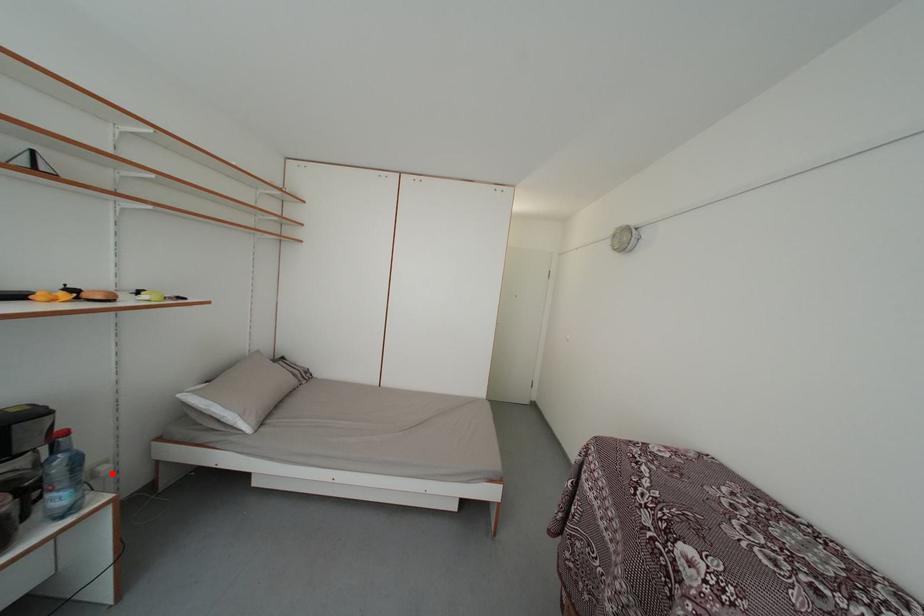
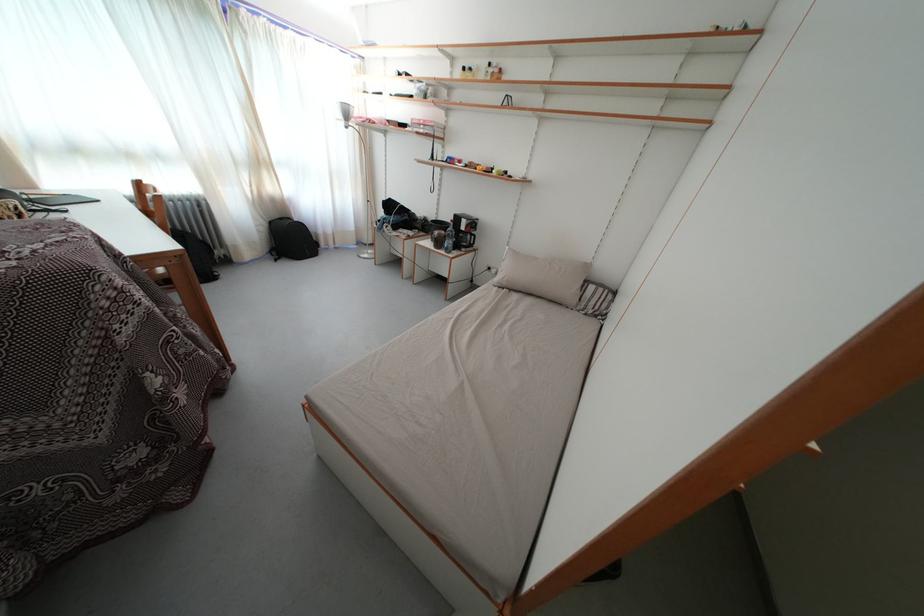
In the second image, find the point that corresponds to the highlighted location in the first image.

(500, 276)